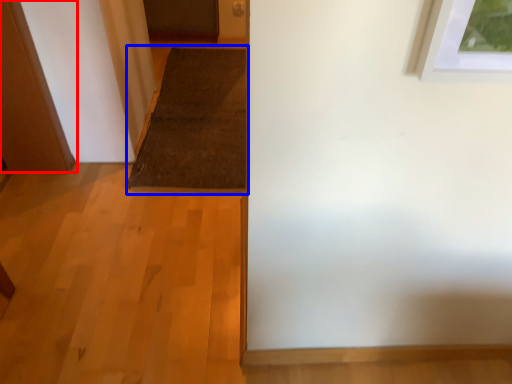
Question: Which object is closer to the camera taking this photo, door (highlighted by a red box) or doormat (highlighted by a blue box)?

Choices:
 (A) door
 (B) doormat

Answer: (A)